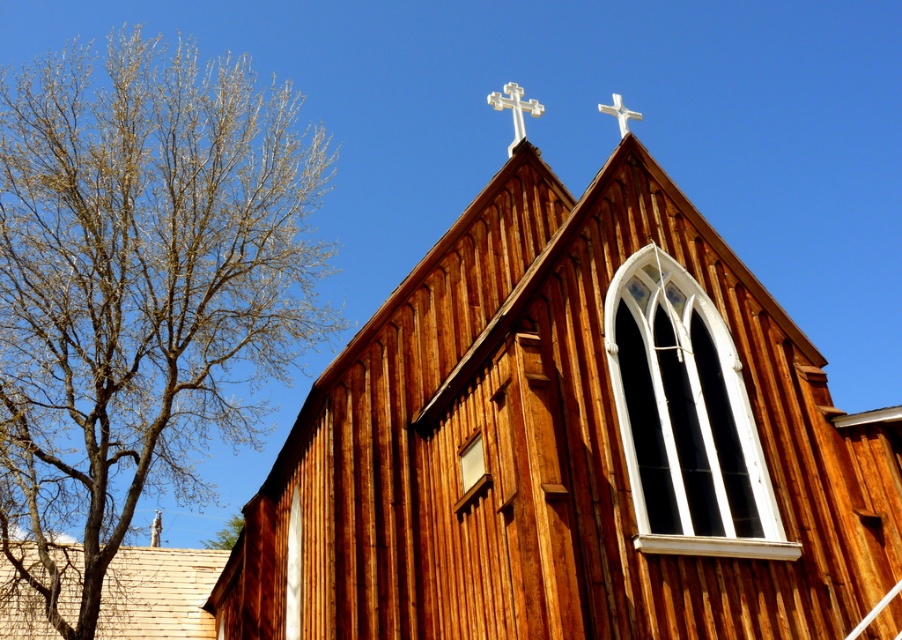
You are standing in front of the wooden church and notice a point marked at coordinates (x=140, y=288). Based on the scene description, what is the location of this point relative to the church?

The point is on a bare wood tree at left, which is not part of the church structure itself.

You are an architect designing a new church and want to ensure that the chapel and cross proportions match the image. Which object in the image is taller, the wooden chapel at upper center or the white wooden cross at upper center?

The wooden chapel at upper center is taller than the white wooden cross at upper center according to the description.